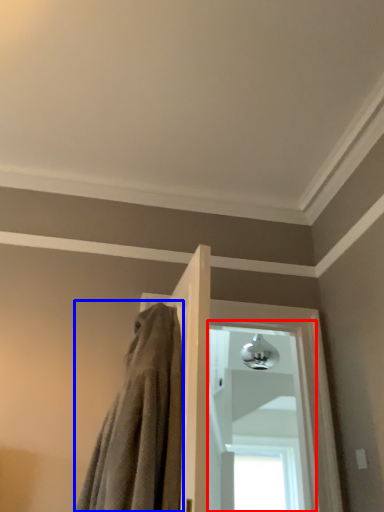
Question: Which of the following is the closest to the observer, window (highlighted by a red box) or bath towel (highlighted by a blue box)?

Choices:
 (A) window
 (B) bath towel

Answer: (B)